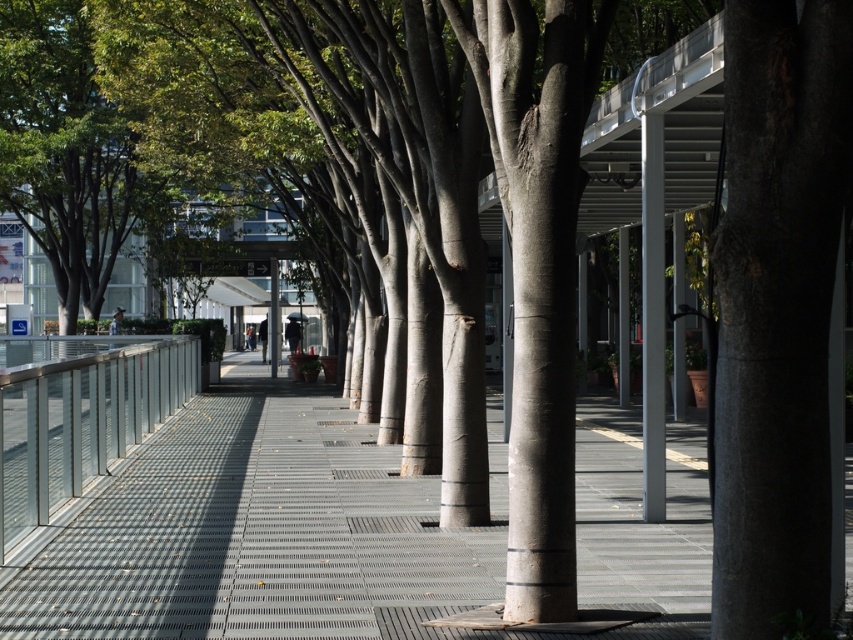
You are standing at the start of the walkway and want to reach the metallic grid pavement at center. According to the coordinates provided, in which direction should you walk from your current position?

The metallic grid pavement at center is located at coordinates point (257,532), so you should walk forward towards the center of the walkway to reach it.

You are standing at the point marked at (96, 545) on the walkway. You want to place a bench that is 1.5 meters long so that it faces the covered walkway with white columns. Can the bench fit in this space without overlapping the railing on the left or the covered walkway on the right?

The distance between the railing on the left and the covered walkway on the right is 8.51 meters. Since the bench is only 1.5 meters long, there is sufficient space to place it without overlapping either structure. The bench can be positioned anywhere within the 8.51 meter width, ensuring it stays clear of both the left railing and the right covered walkway.